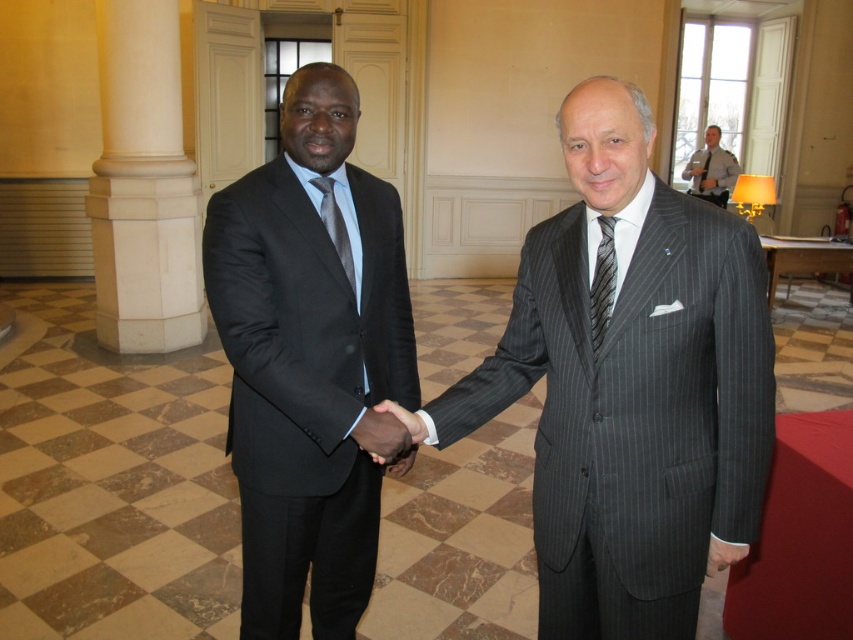
Question: Is striped silk tie at center bigger than matte gray tie at center?

Choices:
 (A) yes
 (B) no

Answer: (B)

Question: Considering the real-world distances, which object is farthest from the gray striped suit at upper right?

Choices:
 (A) black silk hand at center
 (B) striped silk tie at center
 (C) matte black suit at center

Answer: (B)

Question: Among these objects, which one is nearest to the camera?

Choices:
 (A) striped silk tie at center
 (B) gray striped suit at upper right
 (C) matte gray tie at center
 (D) matte black suit at center

Answer: (A)

Question: Does black silk hand at center appear under gray striped suit at upper right?

Choices:
 (A) yes
 (B) no

Answer: (A)

Question: Considering the relative positions of striped silk tie at center and matte gray tie at center in the image provided, where is striped silk tie at center located with respect to matte gray tie at center?

Choices:
 (A) below
 (B) above

Answer: (A)

Question: Which of the following is the farthest from the observer?

Choices:
 (A) (524, 344)
 (B) (386, 400)

Answer: (B)